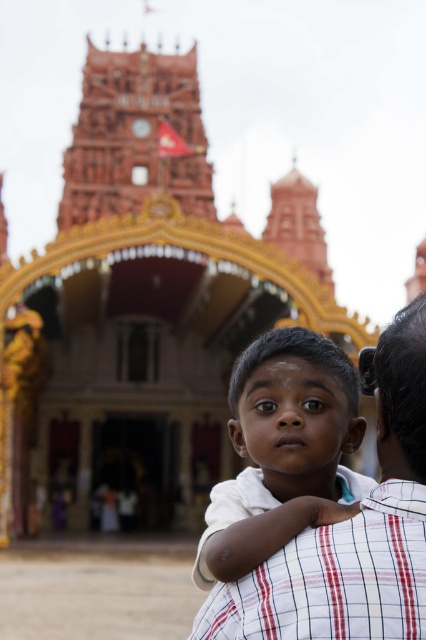
Is point (267, 465) positioned behind point (106, 97)?

No.

Can you confirm if white cotton shirt at center is thinner than terracotta temple at upper center?

Indeed, white cotton shirt at center has a lesser width compared to terracotta temple at upper center.

Is point (291, 497) positioned before point (186, 179)?

Yes, point (291, 497) is in front of point (186, 179).

This screenshot has width=426, height=640. In order to click on white cotton shirt at center in this screenshot , I will do `click(282, 451)`.